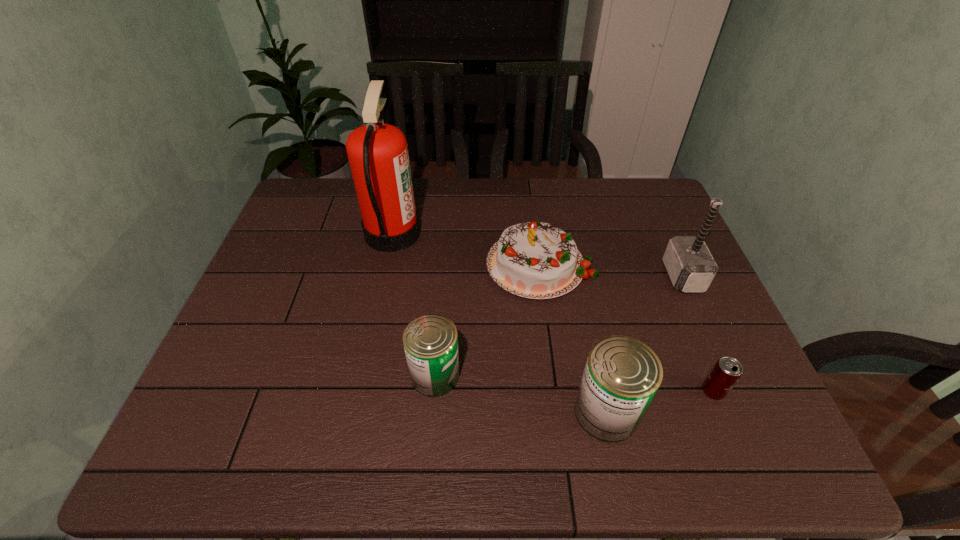
Find the location of a particular element. This screenshot has width=960, height=540. vacant area that lies between the taller can and the tallest object is located at coordinates (499, 322).

Find the location of a particular element. The height and width of the screenshot is (540, 960). empty space between the beer can and the cake is located at coordinates (627, 328).

The image size is (960, 540). In order to click on free space between the leftmost object and the right can in this screenshot , I will do `click(499, 322)`.

The height and width of the screenshot is (540, 960). I want to click on vacant space that is in between the fire extinguisher and the taller can, so click(499, 322).

I want to click on empty location between the cake and the right can, so click(573, 338).

Where is `object that is the third closest to the cake`? Image resolution: width=960 pixels, height=540 pixels. object that is the third closest to the cake is located at coordinates (377, 152).

Choose which object is the third nearest neighbor to the shortest object. Please provide its 2D coordinates. Your answer should be formatted as a tuple, i.e. [(x, y)], where the tuple contains the x and y coordinates of a point satisfying the conditions above.

[(537, 260)]

This screenshot has height=540, width=960. Find the location of `blank space that satisfies the following two spatial constraints: 1. at the nozzle of the cake; 2. on the left side of the tallest object`. blank space that satisfies the following two spatial constraints: 1. at the nozzle of the cake; 2. on the left side of the tallest object is located at coordinates (386, 264).

Where is `free point that satisfies the following two spatial constraints: 1. at the nozzle of the tallest object; 2. on the back side of the beer can`? The image size is (960, 540). free point that satisfies the following two spatial constraints: 1. at the nozzle of the tallest object; 2. on the back side of the beer can is located at coordinates (359, 391).

The width and height of the screenshot is (960, 540). In order to click on vacant point that satisfies the following two spatial constraints: 1. at the nozzle of the leftmost object; 2. on the back side of the cake in this screenshot , I will do `click(386, 264)`.